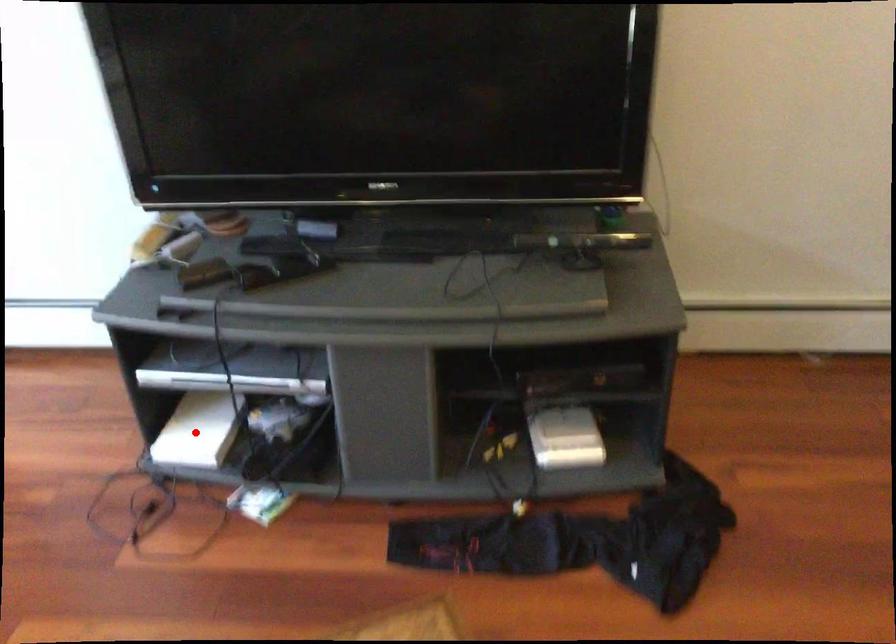
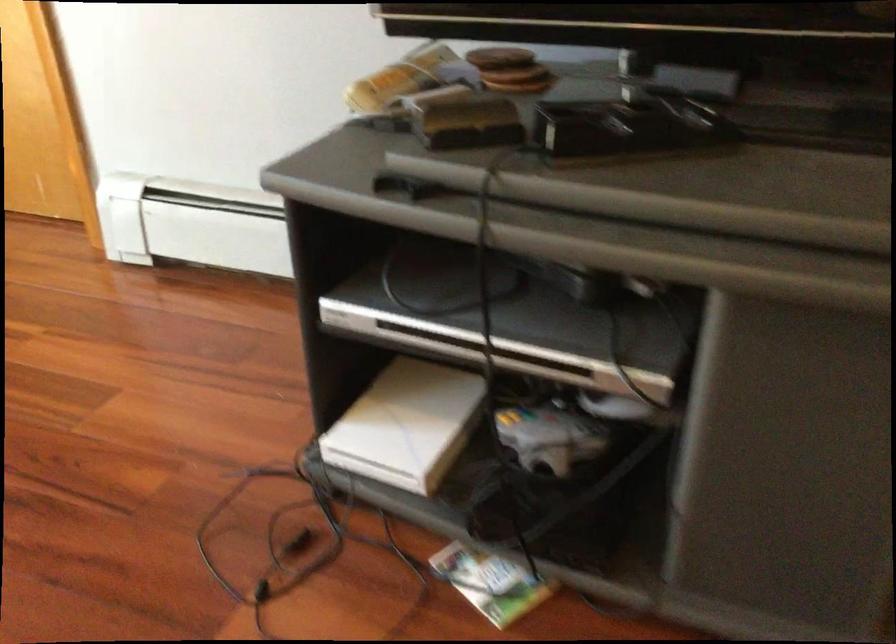
Question: I am providing you with two images of the same scene from different viewpoints. Given a red point in image1, look at the same physical point in image2. Is it:

Choices:
 (A) Closer to the viewpoint
 (B) Farther from the viewpoint

Answer: (A)